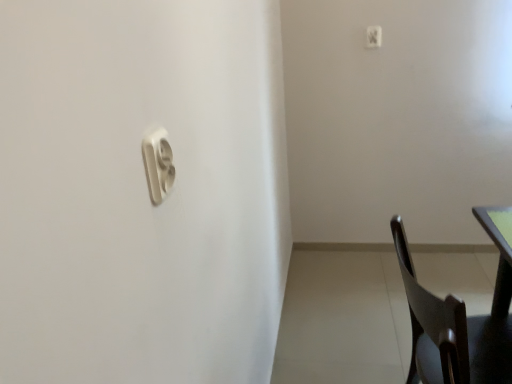
Question: Is white plastic light switch at upper center, positioned as the 2th light switch in back-to-front order, positioned before white plastic light switch at upper right, which ranks as the first light switch in right-to-left order?

Choices:
 (A) no
 (B) yes

Answer: (B)

Question: Is white plastic light switch at upper right, acting as the 2th light switch starting from the front, at the back of white plastic light switch at upper center, positioned as the 2th light switch in back-to-front order?

Choices:
 (A) yes
 (B) no

Answer: (B)

Question: Is white plastic light switch at upper center, which is the first light switch from front to back, not within white plastic light switch at upper right, acting as the 2th light switch starting from the front?

Choices:
 (A) yes
 (B) no

Answer: (A)

Question: Is white plastic light switch at upper center, positioned as the 2th light switch in back-to-front order, aimed at white plastic light switch at upper right, acting as the 2th light switch starting from the front?

Choices:
 (A) yes
 (B) no

Answer: (B)

Question: Considering the relative positions of white plastic light switch at upper center, the 2th light switch positioned from the top, and white plastic light switch at upper right, which ranks as the second light switch in left-to-right order, in the image provided, is white plastic light switch at upper center, the 2th light switch positioned from the top, to the right of white plastic light switch at upper right, which ranks as the second light switch in left-to-right order, from the viewer's perspective?

Choices:
 (A) no
 (B) yes

Answer: (A)

Question: Is the depth of white plastic light switch at upper center, which appears as the second light switch when viewed from the right, greater than that of white plastic light switch at upper right, which appears as the 2th light switch when ordered from the bottom?

Choices:
 (A) no
 (B) yes

Answer: (A)

Question: Is white plastic light switch at upper right, which appears as the 2th light switch when ordered from the bottom, smaller than dark wood chair at lower right?

Choices:
 (A) yes
 (B) no

Answer: (A)

Question: From a real-world perspective, does white plastic light switch at upper right, acting as the 2th light switch starting from the front, stand above dark wood chair at lower right?

Choices:
 (A) no
 (B) yes

Answer: (B)

Question: Is white plastic light switch at upper right, which is counted as the first light switch, starting from the back, positioned far away from dark wood chair at lower right?

Choices:
 (A) no
 (B) yes

Answer: (B)

Question: Does white plastic light switch at upper right, the 1th light switch viewed from the top, turn towards dark wood chair at lower right?

Choices:
 (A) yes
 (B) no

Answer: (B)

Question: Can you confirm if white plastic light switch at upper right, which appears as the 2th light switch when ordered from the bottom, is thinner than dark wood chair at lower right?

Choices:
 (A) yes
 (B) no

Answer: (A)

Question: Is white plastic light switch at upper right, which is counted as the first light switch, starting from the back, in front of dark wood chair at lower right?

Choices:
 (A) yes
 (B) no

Answer: (B)

Question: Is green matte table top at right shorter than dark wood chair at lower right?

Choices:
 (A) no
 (B) yes

Answer: (B)